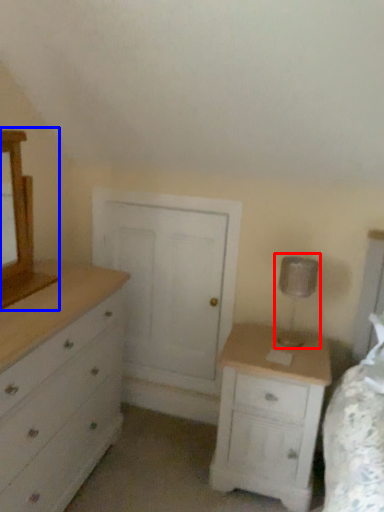
Question: Which object appears closest to the camera in this image, table lamp (highlighted by a red box) or medicine cabinet (highlighted by a blue box)?

Choices:
 (A) table lamp
 (B) medicine cabinet

Answer: (B)